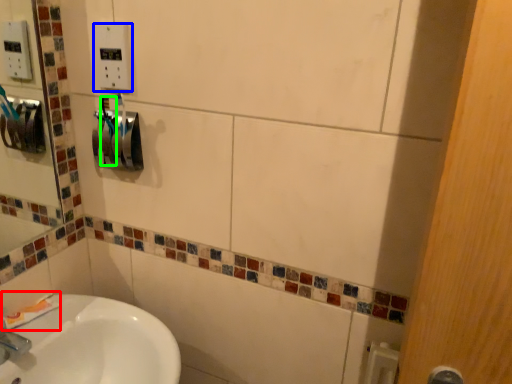
Question: Considering the real-world distances, which object is closest to toothpaste (highlighted by a red box)? electric outlet (highlighted by a blue box) or toothbrush (highlighted by a green box).

Choices:
 (A) electric outlet
 (B) toothbrush

Answer: (B)